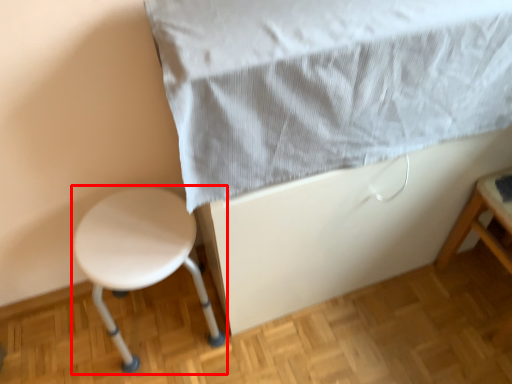
Question: From the image, what is the correct spatial relationship of stool (annotated by the red box) in relation to sheet?

Choices:
 (A) left
 (B) right

Answer: (A)